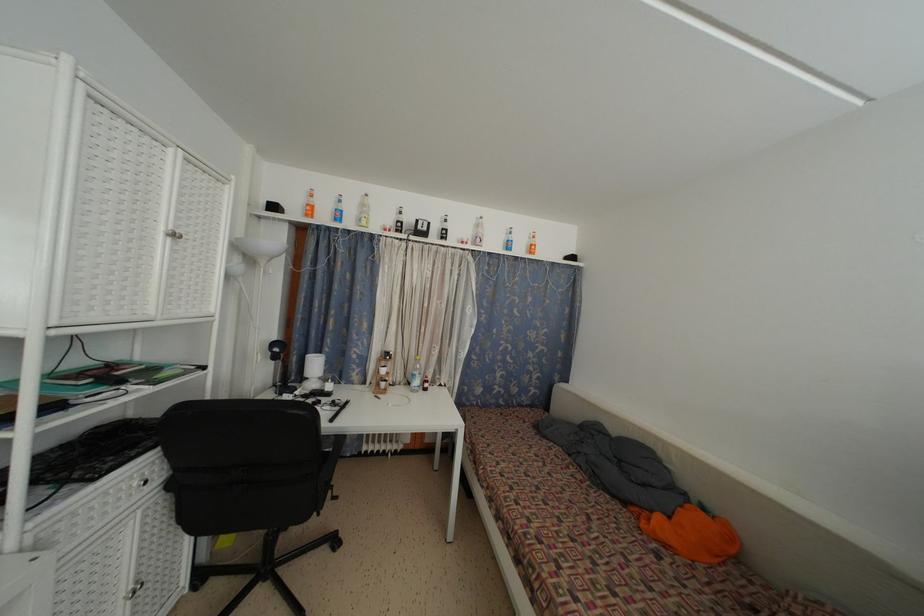
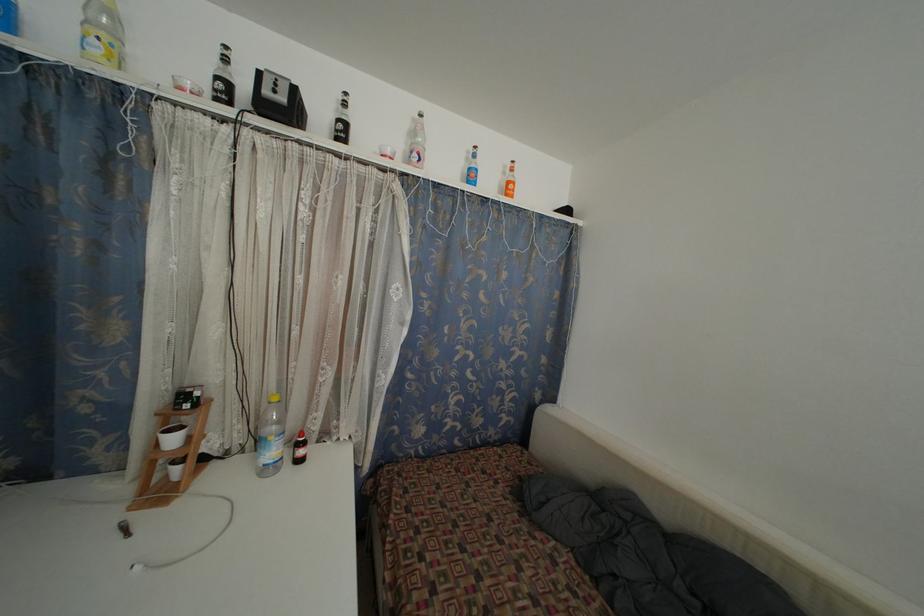
Find the pixel in the second image that matches (387,377) in the first image.

(176, 446)